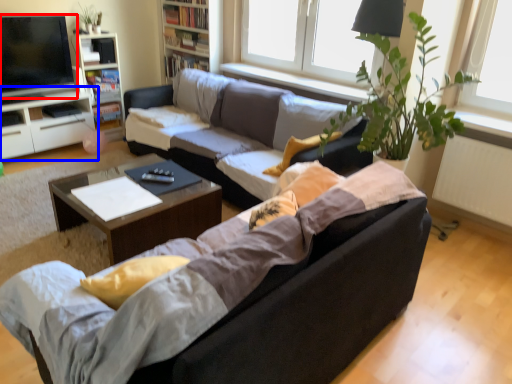
Question: Among these objects, which one is nearest to the camera, television (highlighted by a red box) or cabinetry (highlighted by a blue box)?

Choices:
 (A) television
 (B) cabinetry

Answer: (A)